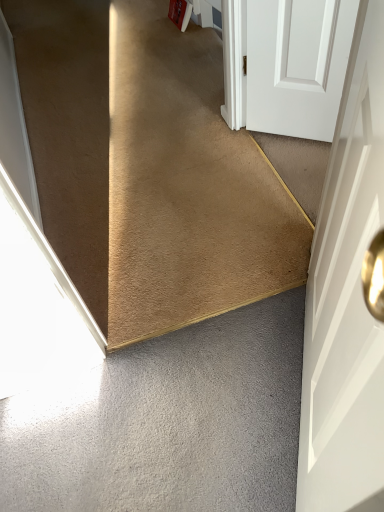
Question: Is carpet at center touching gray matte concrete at lower left?

Choices:
 (A) no
 (B) yes

Answer: (A)

Question: From the image's perspective, is carpet at center over gray matte concrete at lower left?

Choices:
 (A) yes
 (B) no

Answer: (A)

Question: From a real-world perspective, is carpet at center under gray matte concrete at lower left?

Choices:
 (A) no
 (B) yes

Answer: (B)

Question: Can you confirm if carpet at center is wider than gray matte concrete at lower left?

Choices:
 (A) yes
 (B) no

Answer: (A)

Question: Is carpet at center located outside gray matte concrete at lower left?

Choices:
 (A) yes
 (B) no

Answer: (A)

Question: Is carpet at center wider or thinner than white matte door at right?

Choices:
 (A) thin
 (B) wide

Answer: (B)

Question: Do you think carpet at center is within white matte door at right, or outside of it?

Choices:
 (A) outside
 (B) inside

Answer: (A)

Question: From their relative heights in the image, would you say carpet at center is taller or shorter than white matte door at right?

Choices:
 (A) tall
 (B) short

Answer: (B)

Question: From the image's perspective, is carpet at center above or below white matte door at right?

Choices:
 (A) above
 (B) below

Answer: (A)

Question: Is white matte door at right wider or thinner than gray matte concrete at lower left?

Choices:
 (A) thin
 (B) wide

Answer: (A)

Question: Based on their sizes in the image, would you say white matte door at right is bigger or smaller than gray matte concrete at lower left?

Choices:
 (A) small
 (B) big

Answer: (B)

Question: Is white matte door at right inside the boundaries of gray matte concrete at lower left, or outside?

Choices:
 (A) inside
 (B) outside

Answer: (B)

Question: From a real-world perspective, is white matte door at right positioned above or below gray matte concrete at lower left?

Choices:
 (A) above
 (B) below

Answer: (A)

Question: Relative to gray matte concrete at lower left, is carpet at center in front or behind?

Choices:
 (A) front
 (B) behind

Answer: (B)

Question: Is point (211, 278) closer or farther from the camera than point (220, 501)?

Choices:
 (A) closer
 (B) farther

Answer: (B)